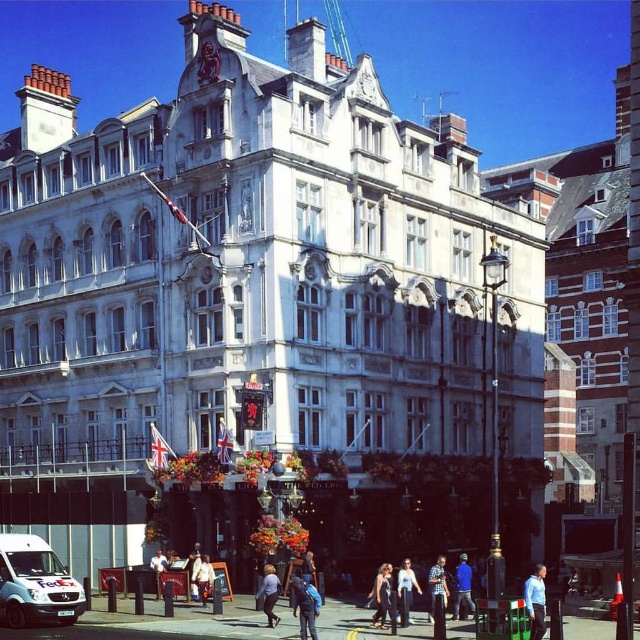
Who is positioned more to the left, white matte fedex van at lower left or light blue jeans at center?

From the viewer's perspective, white matte fedex van at lower left appears more on the left side.

Is point (51, 568) farther from viewer compared to point (275, 600)?

Yes.

Where is `white matte fedex van at lower left`? This screenshot has height=640, width=640. white matte fedex van at lower left is located at coordinates (35, 582).

Can you confirm if white matte fedex van at lower left is wider than light beige jacket at center?

Correct, the width of white matte fedex van at lower left exceeds that of light beige jacket at center.

Looking at this image, between white matte fedex van at lower left and light beige jacket at center, which one is positioned lower?

light beige jacket at center

Is point (19, 560) farther from viewer compared to point (202, 563)?

No, (19, 560) is closer to viewer.

Find the location of a particular element. This screenshot has width=640, height=640. white matte fedex van at lower left is located at coordinates (35, 582).

Is point (44, 598) less distant than point (310, 612)?

No, (44, 598) is further to viewer.

Which is below, white matte fedex van at lower left or blue backpack at center?

Positioned lower is blue backpack at center.

Identify the location of white matte fedex van at lower left. pyautogui.click(x=35, y=582).

The image size is (640, 640). In order to click on white matte fedex van at lower left in this screenshot , I will do `click(35, 582)`.